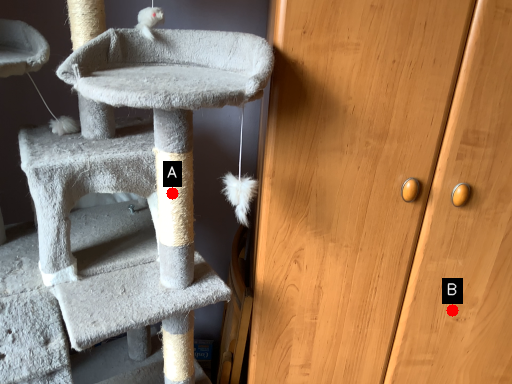
Question: Two points are circled on the image, labeled by A and B beside each circle. Among these points, which one is farthest from the camera?

Choices:
 (A) A is further
 (B) B is further

Answer: (B)